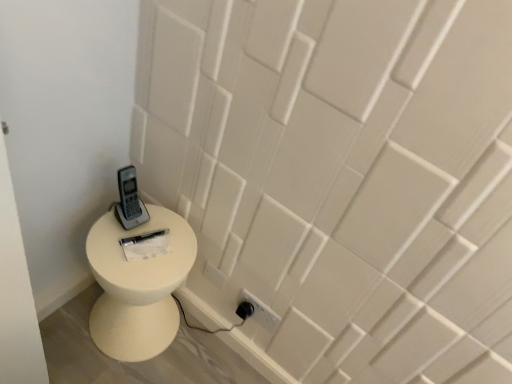
This screenshot has width=512, height=384. Find the location of `vacant point above white matte toilet at lower left (from a real-world perspective)`. vacant point above white matte toilet at lower left (from a real-world perspective) is located at coordinates (139, 243).